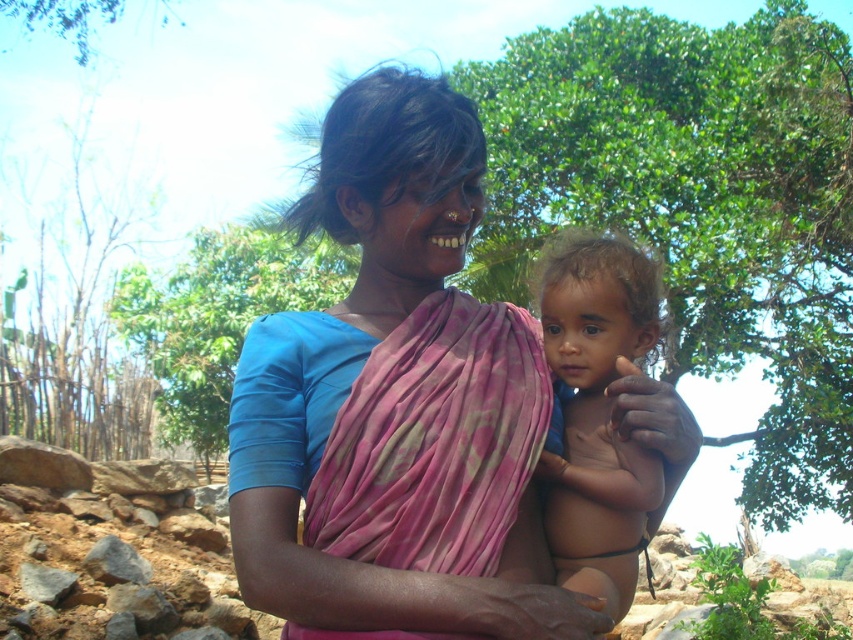
Who is positioned more to the right, pink fabric at center or green leafy tree at center?

pink fabric at center is more to the right.

Does pink fabric at center have a greater height compared to green leafy tree at center?

No, pink fabric at center is not taller than green leafy tree at center.

Describe the element at coordinates (393, 195) in the screenshot. I see `pink fabric at center` at that location.

The width and height of the screenshot is (853, 640). I want to click on pink fabric at center, so click(x=393, y=195).

Looking at this image, does pink fabric at center have a greater width compared to green leafy tree at upper left?

Incorrect, pink fabric at center's width does not surpass green leafy tree at upper left's.

Is pink fabric at center in front of green leafy tree at upper left?

Yes, pink fabric at center is in front of green leafy tree at upper left.

Locate an element on the screen. This screenshot has height=640, width=853. pink fabric at center is located at coordinates pos(393,195).

Is point (566, 497) closer to camera compared to point (135, 340)?

Yes, it is.

Does smooth skin baby at center come behind green leafy tree at center?

That is False.

Between point (607, 428) and point (184, 401), which one is positioned in front?

Point (607, 428) is in front.

Where is `smooth skin baby at center`? The height and width of the screenshot is (640, 853). smooth skin baby at center is located at coordinates (596, 416).